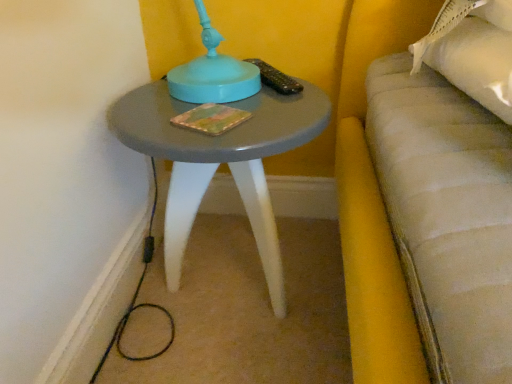
At what (x,y) coordinates should I click in order to perform the action: click on unoccupied space behind multicolored textured book at center. Please return your answer as a coordinate pair (x, y). Looking at the image, I should click on (207, 96).